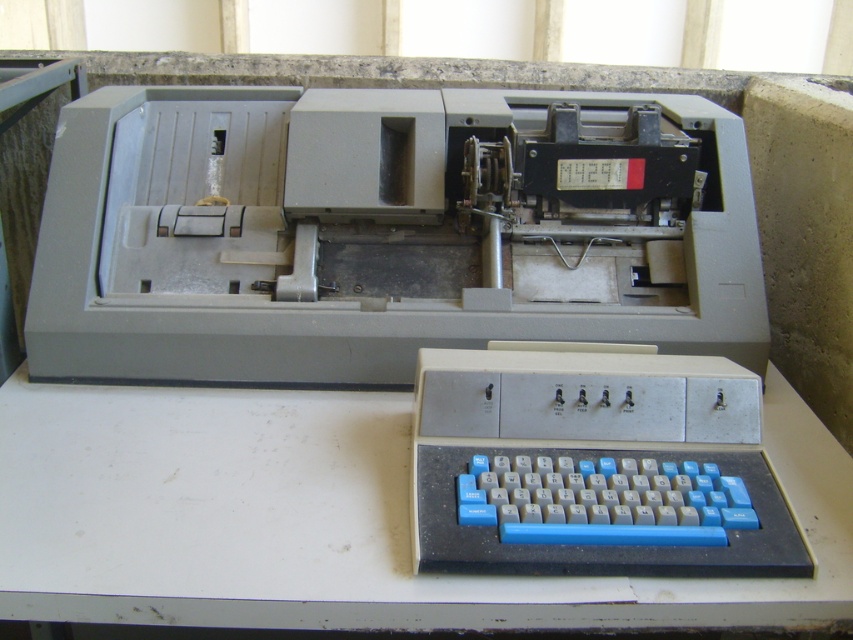
Which is below, gray plastic register at center or white matte table at center?

white matte table at center is below.

Is gray plastic register at center wider than white matte table at center?

No, gray plastic register at center is not wider than white matte table at center.

What do you see at coordinates (386, 230) in the screenshot? I see `gray plastic register at center` at bounding box center [386, 230].

Identify the location of gray plastic register at center. The image size is (853, 640). (386, 230).

From the picture: Does gray plastic register at center appear under blue plastic keyboard at lower center?

No.

Which of these two, gray plastic register at center or blue plastic keyboard at lower center, stands taller?

With more height is gray plastic register at center.

Is point (339, 186) positioned behind point (732, 461)?

Yes, it is behind point (732, 461).

Locate an element on the screen. The image size is (853, 640). gray plastic register at center is located at coordinates (386, 230).

Can you confirm if white matte table at center is positioned above blue plastic keyboard at lower center?

Incorrect, white matte table at center is not positioned above blue plastic keyboard at lower center.

Can you confirm if white matte table at center is smaller than blue plastic keyboard at lower center?

Actually, white matte table at center might be larger than blue plastic keyboard at lower center.

You are a GUI agent. You are given a task and a screenshot of the screen. Output one action in this format:
    pyautogui.click(x=<x>, y=<y>)
    Task: Click on the white matte table at center
    The width and height of the screenshot is (853, 640).
    Given the screenshot: What is the action you would take?
    pyautogui.click(x=329, y=518)